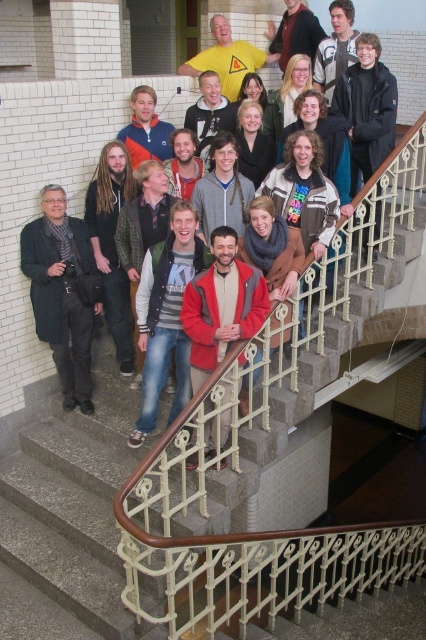
Question: Where is red matte jacket at center located in relation to matte black jacket at center in the image?

Choices:
 (A) left
 (B) right

Answer: (A)

Question: Can you confirm if dark brown leather jacket at left is positioned to the right of matte black jacket at upper center?

Choices:
 (A) yes
 (B) no

Answer: (B)

Question: Which point appears farthest from the camera in this image?

Choices:
 (A) (317, 81)
 (B) (169, 292)
 (C) (115, 211)

Answer: (A)

Question: Which is farther from the matte yellow t-shirt at center?

Choices:
 (A) dark gray wool coat at left
 (B) red matte jacket at center

Answer: (A)

Question: Which object is farther from the camera taking this photo?

Choices:
 (A) matte yellow t-shirt at center
 (B) dark brown leather jacket at center

Answer: (A)

Question: In this image, where is matte black jacket at upper center located relative to matte yellow t-shirt at center?

Choices:
 (A) right
 (B) left

Answer: (A)